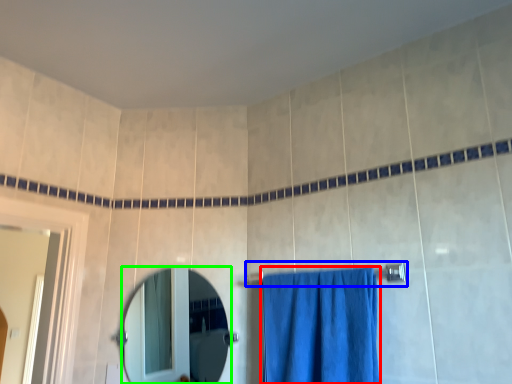
Question: Which object is the farthest from curtain (highlighted by a red box)? Choose among these: towel bar (highlighted by a blue box) or mirror (highlighted by a green box).

Choices:
 (A) towel bar
 (B) mirror

Answer: (B)